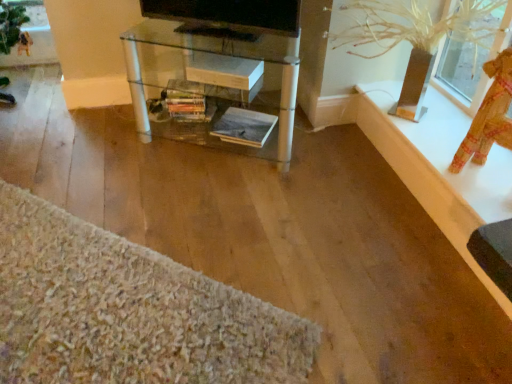
I want to click on free spot in front of clear glass table at center, so click(251, 220).